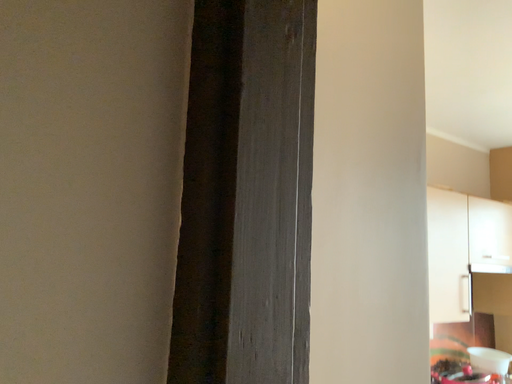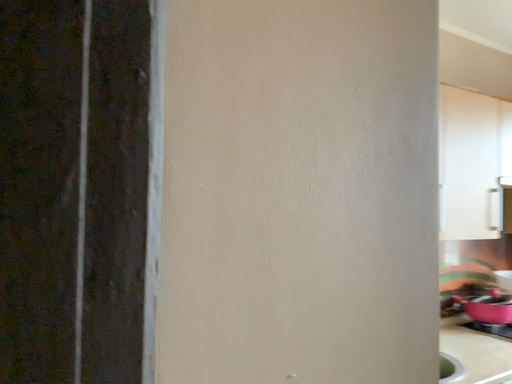
Question: How did the camera likely rotate when shooting the video?

Choices:
 (A) rotated downward
 (B) rotated upward

Answer: (A)